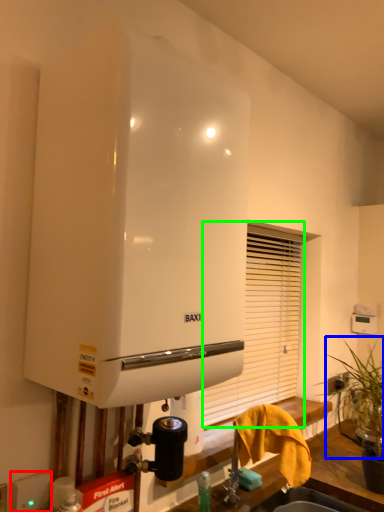
Question: Considering the real-world distances, which object is farthest from electric outlet (highlighted by a red box)? plant (highlighted by a blue box) or shutter (highlighted by a green box)?

Choices:
 (A) plant
 (B) shutter

Answer: (B)